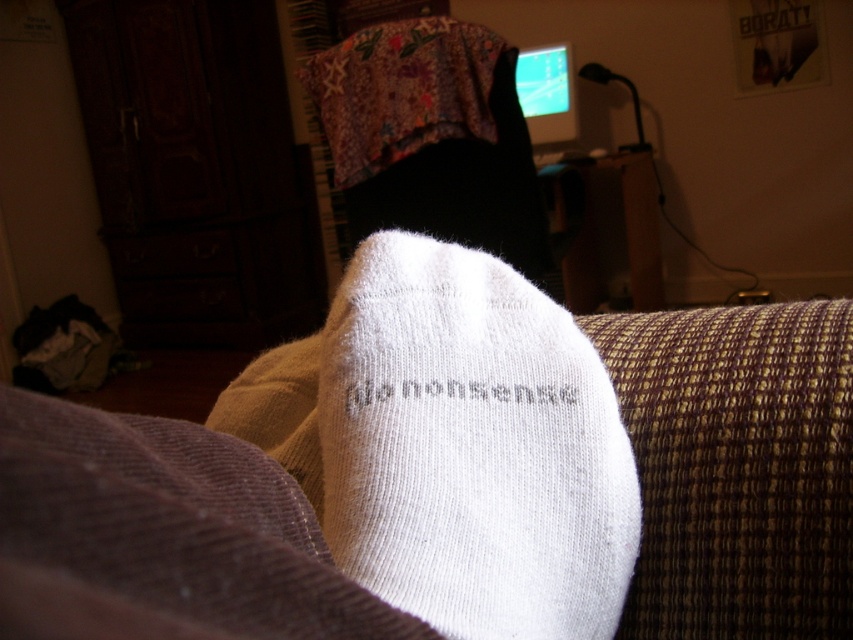
Which is in front, point (227, 605) or point (482, 561)?

Point (227, 605) is in front.

You are a GUI agent. You are given a task and a screenshot of the screen. Output one action in this format:
    pyautogui.click(x=<x>, y=<y>)
    Task: Click on the white knitted couch at lower center
    The height and width of the screenshot is (640, 853).
    Given the screenshot: What is the action you would take?
    pyautogui.click(x=738, y=467)

This screenshot has height=640, width=853. What do you see at coordinates (738, 467) in the screenshot?
I see `white knitted couch at lower center` at bounding box center [738, 467].

At what (x,y) coordinates should I click in order to perform the action: click on white knitted couch at lower center. Please return your answer as a coordinate pair (x, y). The width and height of the screenshot is (853, 640). Looking at the image, I should click on (738, 467).